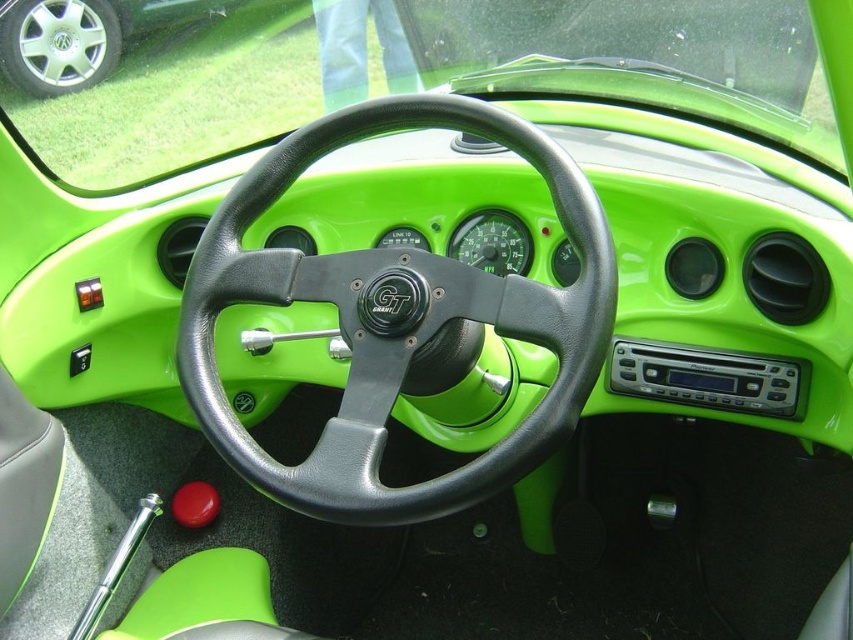
Question: Among these points, which one is nearest to the camera?

Choices:
 (A) (350, 264)
 (B) (102, 42)

Answer: (A)

Question: Is black leather steering wheel at center to the left of silver metallic wheel at upper left from the viewer's perspective?

Choices:
 (A) yes
 (B) no

Answer: (B)

Question: Is black leather steering wheel at center further to camera compared to silver metallic wheel at upper left?

Choices:
 (A) no
 (B) yes

Answer: (A)

Question: Does black leather steering wheel at center come in front of silver metallic wheel at upper left?

Choices:
 (A) no
 (B) yes

Answer: (B)